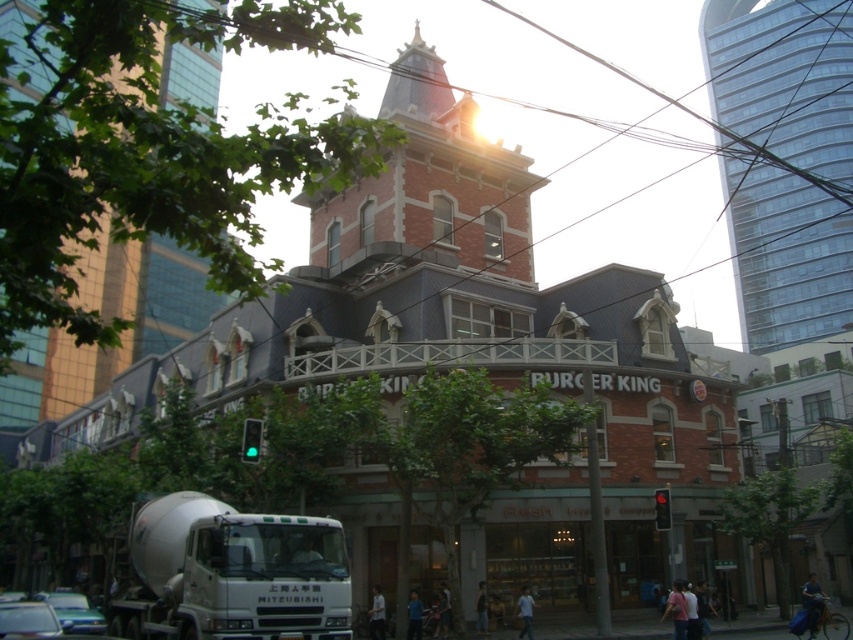
You are a fashion designer observing a person wearing a white matte shirt at lower center and a light brown leather jacket at lower center. Which clothing item is closer to the bottom of the image?

The white matte shirt at lower center is positioned under the light brown leather jacket at lower center, meaning it is closer to the bottom of the image.

You are a fashion designer observing two shirts displayed on a rack in the image. The shirts are the white matte shirt at lower center and the blue fabric shirt at lower center. Which shirt is closer to you?

The white matte shirt at lower center is closer to you because it is further to the viewer than the blue fabric shirt at lower center.